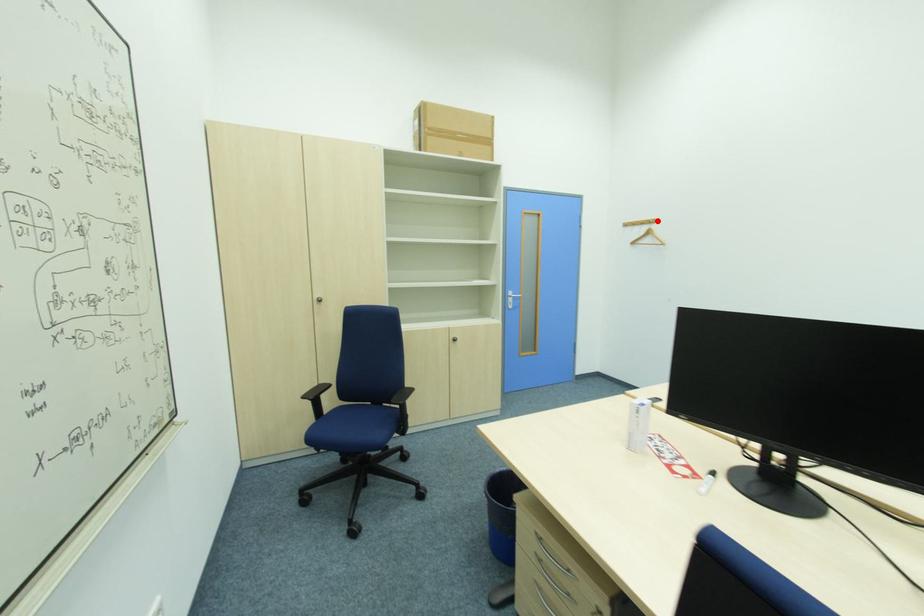
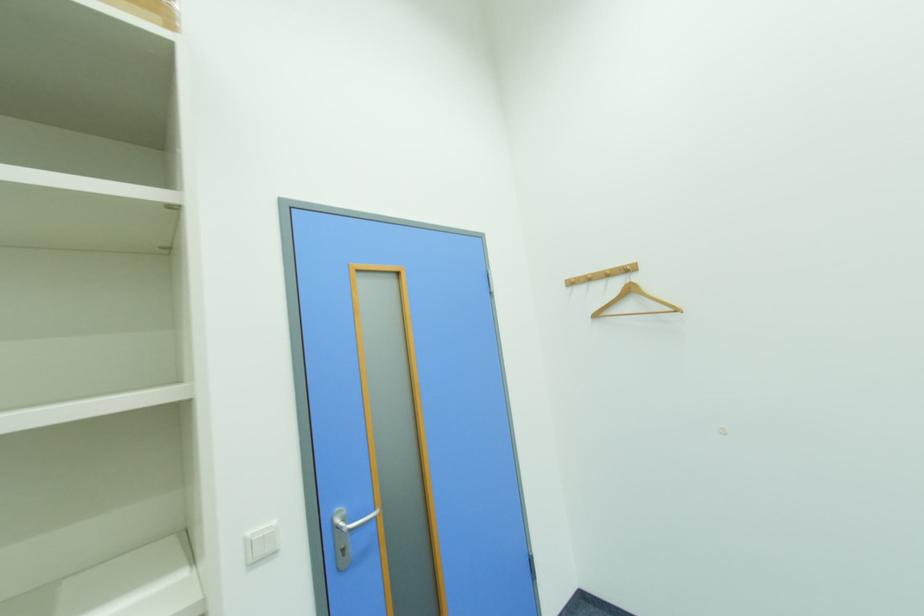
The point at the highlighted location is marked in the first image. Where is the corresponding point in the second image?

(634, 267)